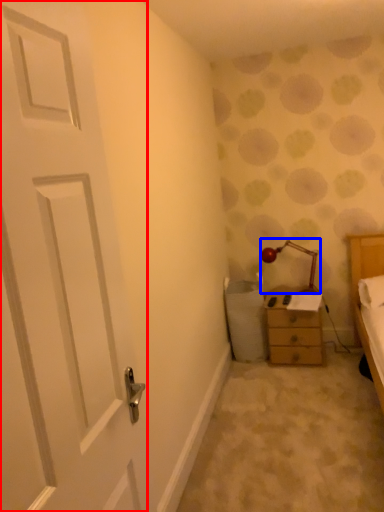
Question: Which object is closer to the camera taking this photo, door (highlighted by a red box) or lamp (highlighted by a blue box)?

Choices:
 (A) door
 (B) lamp

Answer: (A)